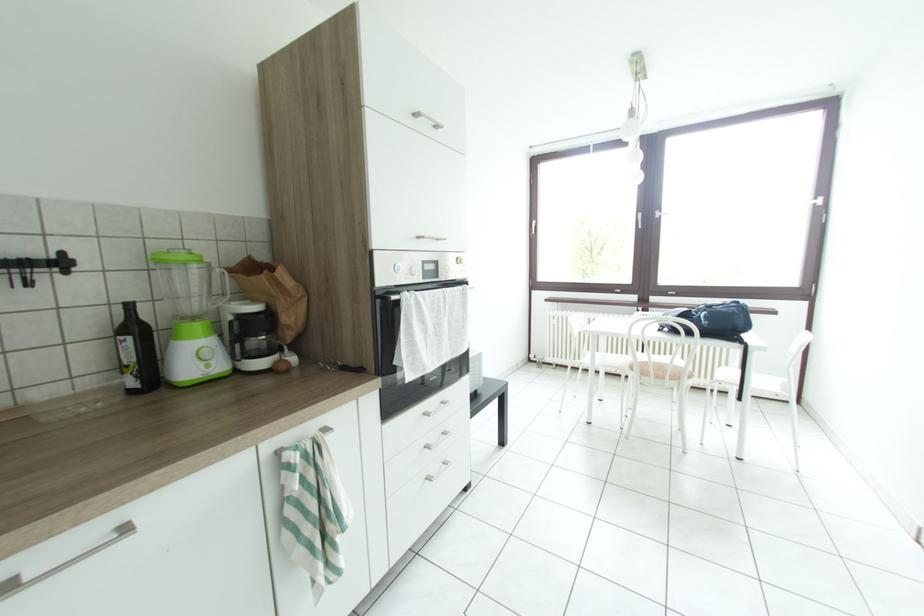
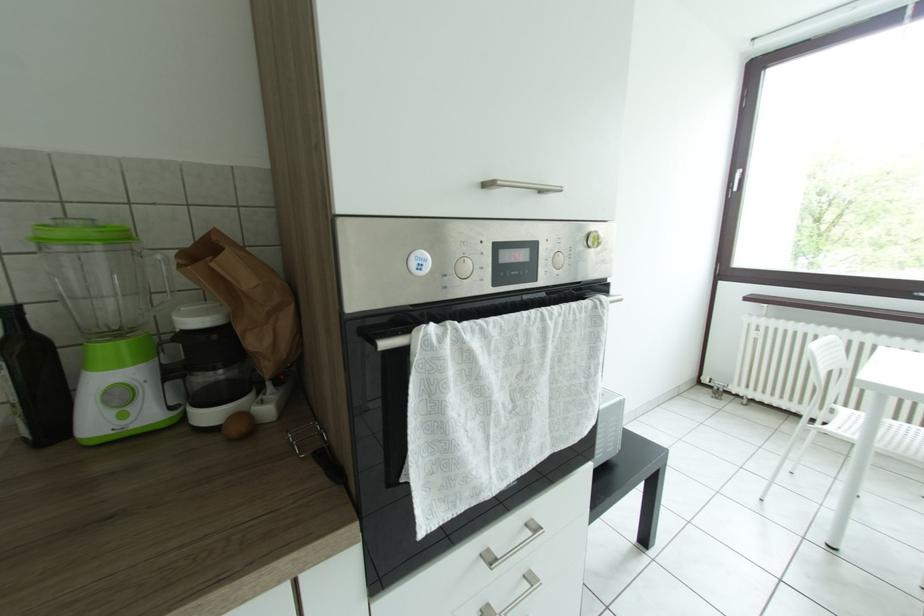
Question: The camera is either moving clockwise (left) or counter-clockwise (right) around the object. The first image is from the beginning of the video and the second image is from the end. Is the camera moving left or right when shooting the video?

Choices:
 (A) Left
 (B) Right

Answer: (B)